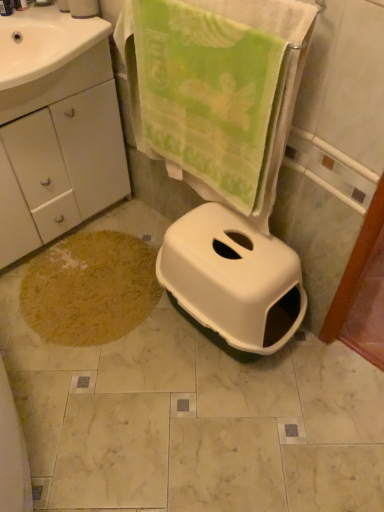
Describe the element at coordinates (83, 8) in the screenshot. I see `white matte toilet paper at upper left` at that location.

Measure the distance between point (2, 42) and camera.

Point (2, 42) is 1.53 meters from camera.

This screenshot has width=384, height=512. Describe the element at coordinates (49, 59) in the screenshot. I see `white glossy sink at upper left` at that location.

Image resolution: width=384 pixels, height=512 pixels. Describe the element at coordinates (90, 288) in the screenshot. I see `yellow textured bath mat at lower left` at that location.

This screenshot has width=384, height=512. Find the location of `white matte toilet paper at upper left`. white matte toilet paper at upper left is located at coordinates (83, 8).

Would you say white matte cabinet at lower left is a long distance from green soft towel at upper center?

white matte cabinet at lower left is actually quite close to green soft towel at upper center.

Which is behind, point (18, 194) or point (270, 155)?

The point (18, 194) is behind.

What's the angular difference between white matte cabinet at lower left and green soft towel at upper center's facing directions?

88.8 degrees separate the facing orientations of white matte cabinet at lower left and green soft towel at upper center.

Is the depth of white matte cabinet at lower left less than that of green soft towel at upper center?

No, the depth of white matte cabinet at lower left is greater than that of green soft towel at upper center.

In the image, there is a white matte toilet paper at upper left. Identify the location of bathroom cabinet below it (from the image's perspective). The image size is (384, 512). (56, 129).

Could you tell me if white matte cabinet at lower left is facing white matte toilet paper at upper left?

No, white matte cabinet at lower left is not facing towards white matte toilet paper at upper left.

Is white matte cabinet at lower left thinner than white matte toilet paper at upper left?

In fact, white matte cabinet at lower left might be wider than white matte toilet paper at upper left.

Is green soft towel at upper center next to white plastic toilet at center?

No, green soft towel at upper center is not beside white plastic toilet at center.

Is green soft towel at upper center further to the viewer compared to white plastic toilet at center?

No, it is not.

Can you tell me how much green soft towel at upper center and white plastic toilet at center differ in facing direction?

The facing directions of green soft towel at upper center and white plastic toilet at center are 92.1 degrees apart.

Considering the relative sizes of green soft towel at upper center and white plastic toilet at center in the image provided, is green soft towel at upper center wider than white plastic toilet at center?

In fact, green soft towel at upper center might be narrower than white plastic toilet at center.

Find the location of `sink that appears below the white matte toilet paper at upper left (from a real-world perspective)`. sink that appears below the white matte toilet paper at upper left (from a real-world perspective) is located at coordinates (49, 59).

Is white matte toilet paper at upper left oriented towards white glossy sink at upper left?

No, white matte toilet paper at upper left is not aimed at white glossy sink at upper left.

Considering the relative sizes of white matte toilet paper at upper left and white glossy sink at upper left in the image provided, is white matte toilet paper at upper left bigger than white glossy sink at upper left?

Incorrect, white matte toilet paper at upper left is not larger than white glossy sink at upper left.

Is white matte toilet paper at upper left oriented towards green soft towel at upper center?

No, white matte toilet paper at upper left is not facing towards green soft towel at upper center.

Between white matte toilet paper at upper left and green soft towel at upper center, which one has larger width?

Wider between the two is white matte toilet paper at upper left.

Is white matte toilet paper at upper left situated inside green soft towel at upper center or outside?

The correct answer is: outside.

From the image's perspective, is white matte toilet paper at upper left above green soft towel at upper center?

Yes.

Consider the image. Would you say yellow textured bath mat at lower left contains white plastic toilet at center?

No.

Is white plastic toilet at center at the back of yellow textured bath mat at lower left?

No, yellow textured bath mat at lower left's orientation is not away from white plastic toilet at center.

Between point (88, 243) and point (170, 242), which one is positioned in front?

The point (170, 242) is more forward.

Can you confirm if yellow textured bath mat at lower left is smaller than white plastic toilet at center?

Yes, yellow textured bath mat at lower left is smaller than white plastic toilet at center.

From a real-world perspective, which object rests below the other?

green soft towel at upper center is physically lower.

Find the location of a particular element. sink located on the left of green soft towel at upper center is located at coordinates (49, 59).

Can you confirm if green soft towel at upper center is smaller than white glossy sink at upper left?

Correct, green soft towel at upper center occupies less space than white glossy sink at upper left.

Which object is further away from the camera, green soft towel at upper center or white glossy sink at upper left?

white glossy sink at upper left is more distant.

Where is `bathroom cabinet located behind the green soft towel at upper center`? bathroom cabinet located behind the green soft towel at upper center is located at coordinates (56, 129).

At what (x,y) coordinates should I click in order to perform the action: click on bathroom cabinet on the left of white matte toilet paper at upper left. Please return your answer as a coordinate pair (x, y). This screenshot has height=512, width=384. Looking at the image, I should click on (56, 129).

From the picture: From the image, which object appears to be nearer to white glossy sink at upper left, white matte toilet paper at upper left or yellow textured bath mat at lower left?

white matte toilet paper at upper left is positioned closer to the anchor white glossy sink at upper left.

Which object lies nearer to the anchor point yellow textured bath mat at lower left, white matte cabinet at lower left or green soft towel at upper center?

Among the two, white matte cabinet at lower left is located nearer to yellow textured bath mat at lower left.

Estimate the real-world distances between objects in this image. Which object is closer to white matte cabinet at lower left, yellow textured bath mat at lower left or white matte toilet paper at upper left?

Among the two, yellow textured bath mat at lower left is located nearer to white matte cabinet at lower left.

Based on the photo, when comparing their distances from white matte toilet paper at upper left, does yellow textured bath mat at lower left or white glossy sink at upper left seem further?

Based on the image, yellow textured bath mat at lower left appears to be further to white matte toilet paper at upper left.

Estimate the real-world distances between objects in this image. Which object is closer to white matte cabinet at lower left, white glossy sink at upper left or yellow textured bath mat at lower left?

white glossy sink at upper left is closer to white matte cabinet at lower left.

Considering their positions, is white matte toilet paper at upper left positioned closer to white matte cabinet at lower left than white glossy sink at upper left?

white glossy sink at upper left is closer to white matte cabinet at lower left.

Based on their spatial positions, is green soft towel at upper center or white plastic toilet at center further from white glossy sink at upper left?

Among the two, white plastic toilet at center is located further to white glossy sink at upper left.

Estimate the real-world distances between objects in this image. Which object is further from white glossy sink at upper left, white matte cabinet at lower left or yellow textured bath mat at lower left?

yellow textured bath mat at lower left.

The width and height of the screenshot is (384, 512). I want to click on sink between white matte toilet paper at upper left and yellow textured bath mat at lower left from top to bottom, so (x=49, y=59).

Locate an element on the screen. Image resolution: width=384 pixels, height=512 pixels. beach towel between white matte toilet paper at upper left and yellow textured bath mat at lower left from top to bottom is located at coordinates (216, 91).

Where is `sink between white matte toilet paper at upper left and white plastic toilet at center in the vertical direction`? sink between white matte toilet paper at upper left and white plastic toilet at center in the vertical direction is located at coordinates (49, 59).

Identify the location of beach towel between white matte cabinet at lower left and white plastic toilet at center in the horizontal direction. This screenshot has width=384, height=512. (216, 91).